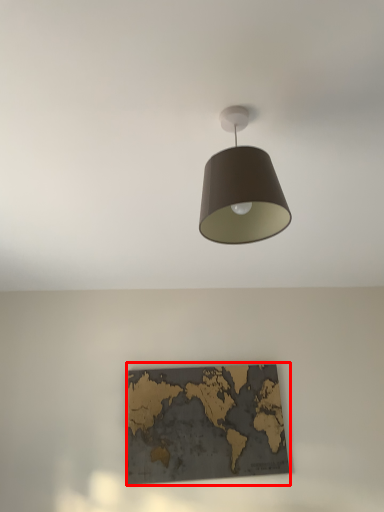
Question: From the image's perspective, where is picture frame (annotated by the red box) located in relation to lamp in the image?

Choices:
 (A) below
 (B) above

Answer: (A)